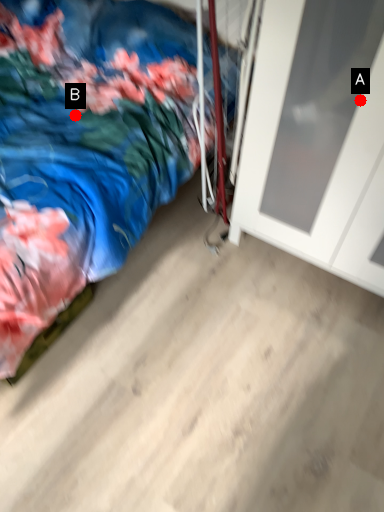
Question: Two points are circled on the image, labeled by A and B beside each circle. Among these points, which one is nearest to the camera?

Choices:
 (A) A is closer
 (B) B is closer

Answer: (A)